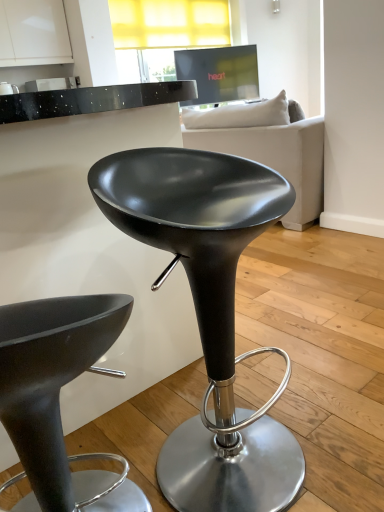
Question: Is matte black stool at center, which appears as the 2th stool when viewed from the right, wider or thinner than white fabric couch at upper center?

Choices:
 (A) wide
 (B) thin

Answer: (B)

Question: In terms of height, does matte black stool at center, which appears as the 2th stool when viewed from the right, look taller or shorter compared to white fabric couch at upper center?

Choices:
 (A) tall
 (B) short

Answer: (B)

Question: Which is farther from the white fabric couch at upper center?

Choices:
 (A) matte black stool at center, acting as the 2th stool starting from the left
 (B) matte black stool at center, which appears as the 2th stool when viewed from the right

Answer: (B)

Question: Which object is positioned closest to the matte black stool at center, the 1th stool positioned from the right?

Choices:
 (A) white fabric couch at upper center
 (B) matte black stool at center, the 1th stool positioned from the left

Answer: (B)